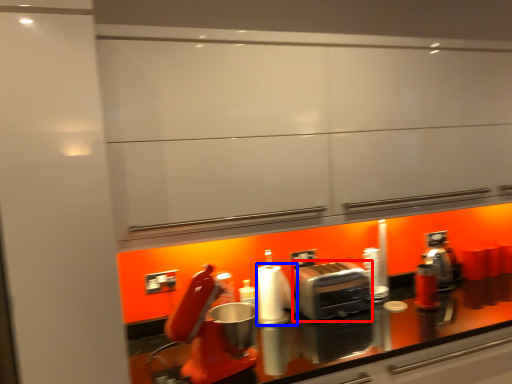
Question: Which point is further to the camera, toaster (highlighted by a red box) or paper towel (highlighted by a blue box)?

Choices:
 (A) toaster
 (B) paper towel

Answer: (A)